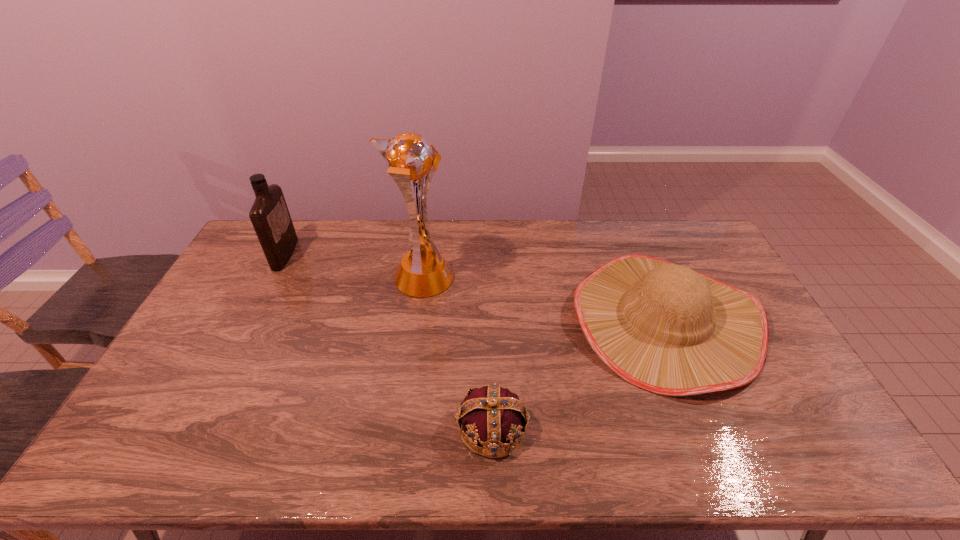
At what (x,y) coordinates should I click in order to perform the action: click on free space located 0.110m on the front of the sunhat. Please return your answer as a coordinate pair (x, y). The image size is (960, 540). Looking at the image, I should click on (714, 440).

Where is `vacant space positioned on the right of the third object from left to right`? This screenshot has height=540, width=960. vacant space positioned on the right of the third object from left to right is located at coordinates (581, 428).

Locate an element on the screen. This screenshot has width=960, height=540. object situated at the far edge is located at coordinates (269, 214).

You are a GUI agent. You are given a task and a screenshot of the screen. Output one action in this format:
    pyautogui.click(x=<x>, y=<y>)
    Task: Click on the object at the near edge
    The image size is (960, 540).
    Given the screenshot: What is the action you would take?
    pyautogui.click(x=492, y=415)

Where is `object that is at the left edge`? object that is at the left edge is located at coordinates (269, 214).

At what (x,y) coordinates should I click in order to perform the action: click on object located at the right edge. Please return your answer as a coordinate pair (x, y). Looking at the image, I should click on (667, 329).

Where is `object present at the far left corner`? This screenshot has width=960, height=540. object present at the far left corner is located at coordinates (269, 214).

Locate an element on the screen. The width and height of the screenshot is (960, 540). blank space at the far edge of the desktop is located at coordinates (513, 226).

Image resolution: width=960 pixels, height=540 pixels. In the image, there is a desktop. Identify the location of free region at the near edge. (365, 462).

Locate an element on the screen. The height and width of the screenshot is (540, 960). free location at the left edge of the desktop is located at coordinates point(258,306).